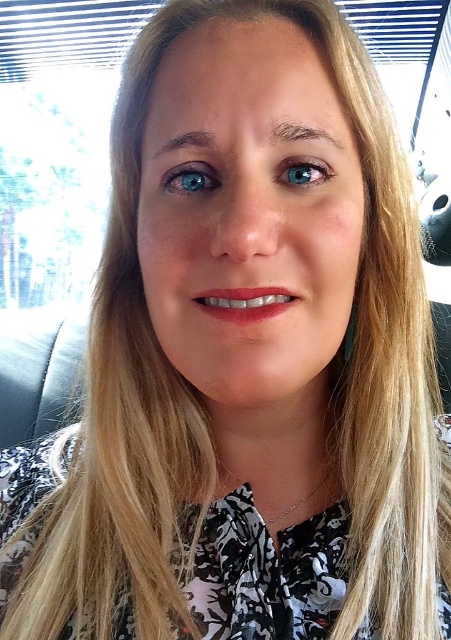
Find the location of a particular element. The height and width of the screenshot is (640, 451). blue glossy eye at upper left is located at coordinates (191, 177).

Which is more to the right, blue glossy eye at upper left or blue glossy eye at center?

blue glossy eye at center is more to the right.

Is point (165, 188) more distant than point (289, 157)?

Yes, point (165, 188) is behind point (289, 157).

This screenshot has width=451, height=640. In order to click on blue glossy eye at upper left in this screenshot , I will do `click(191, 177)`.